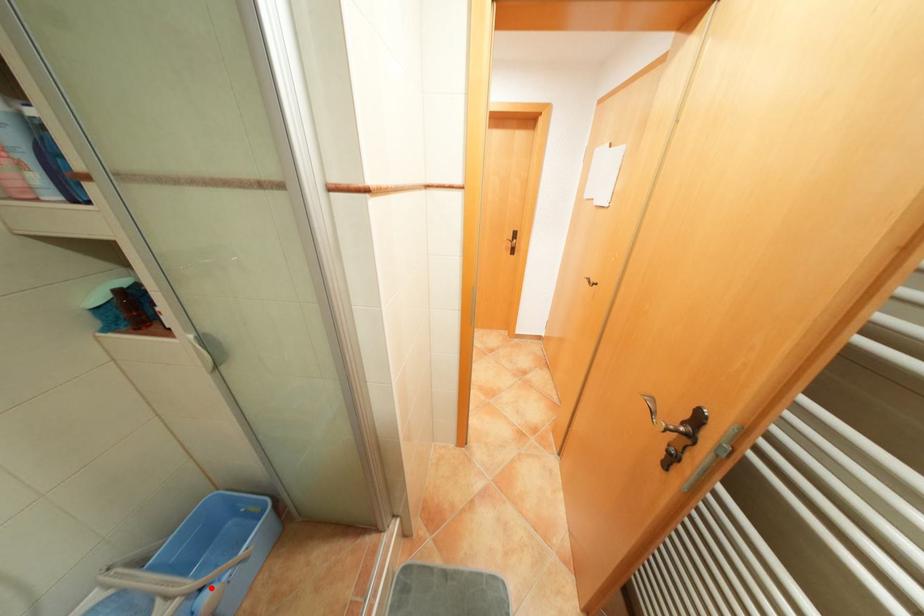
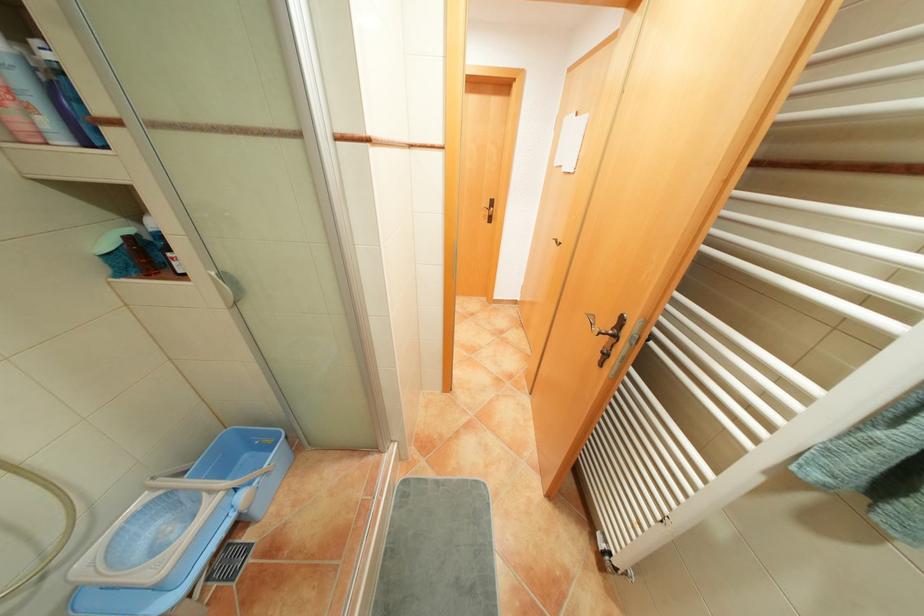
Locate, in the second image, the point that corresponds to the highlighted location in the first image.

(247, 488)